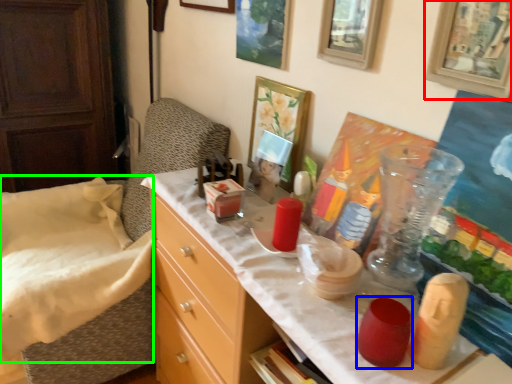
Question: Which object is positioned closest to picture frame (highlighted by a red box)? Select from candle holder (highlighted by a blue box) and sheet (highlighted by a green box).

Choices:
 (A) candle holder
 (B) sheet

Answer: (A)